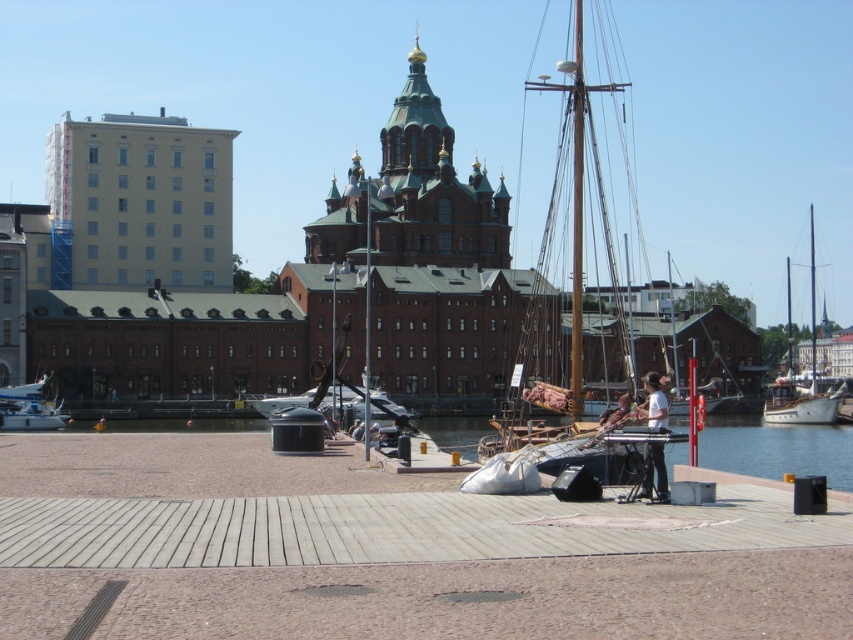
Consider the image. You are standing at the point marked as point (387, 550) in the image. Looking around, you see wooden at center. Which direction should you face to see the wooden dock extending into the water?

The point (387, 550) corresponds to the wooden dock extending into the water, so you are already facing the wooden dock.

You are planning to place a decorative item on the wooden at center. Considering the white plastic boat at lower left is nearby, which object has a larger width to accommodate more items?

The wooden at center has a larger width than the white plastic boat at lower left, so it can accommodate more items.